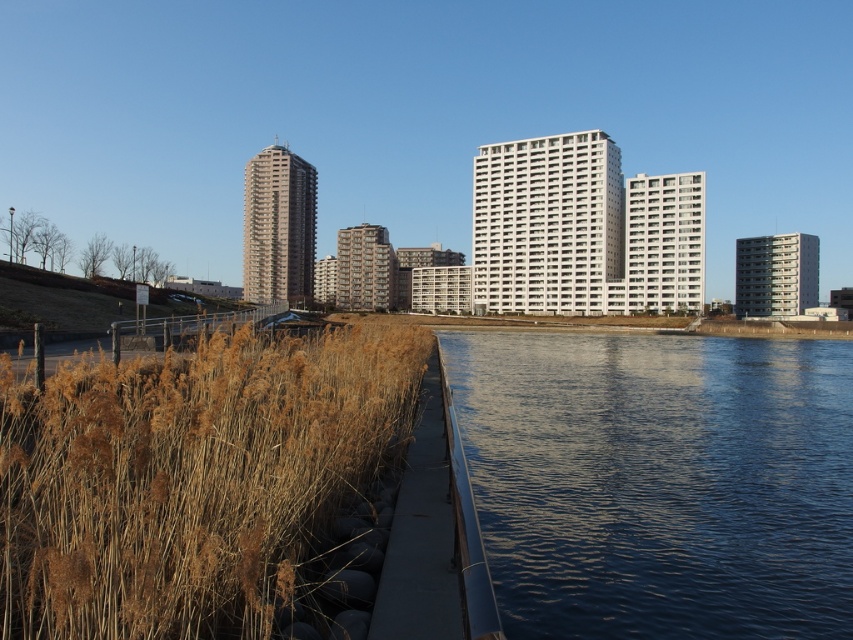
You are a photographer standing on the walkway and want to capture both the blue smooth water at lower right and the dry grass at lower left in the same frame. Based on their positions, which object will appear closer to the bottom edge of your photo?

The blue smooth water at lower right is positioned under dry grass at lower left, so the blue smooth water at lower right will appear closer to the bottom edge of your photo.

You are standing on the concrete walkway and want to find the blue smooth water at lower right. According to the scene description, where should you look relative to your position?

The blue smooth water at lower right is located at point (659,481), so you should look towards the lower right direction from your current position on the concrete walkway.